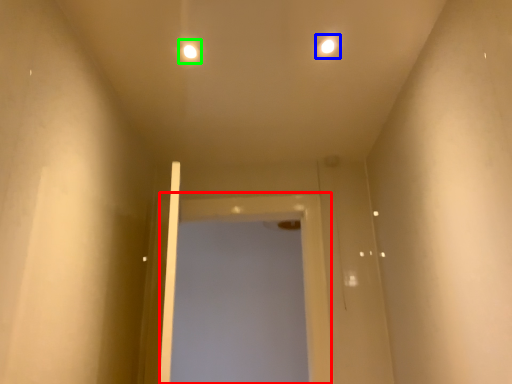
Question: Based on their relative distances, which object is farther from screen door (highlighted by a red box)? Choose from light (highlighted by a blue box) and light (highlighted by a green box).

Choices:
 (A) light
 (B) light

Answer: (A)